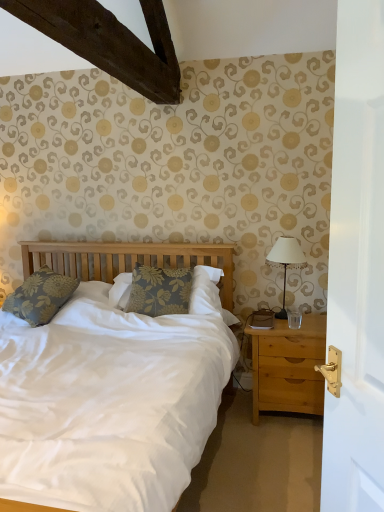
Locate an element on the screen. This screenshot has height=512, width=384. vacant space in white fabric-covered lamp at right (from a real-world perspective) is located at coordinates (294, 317).